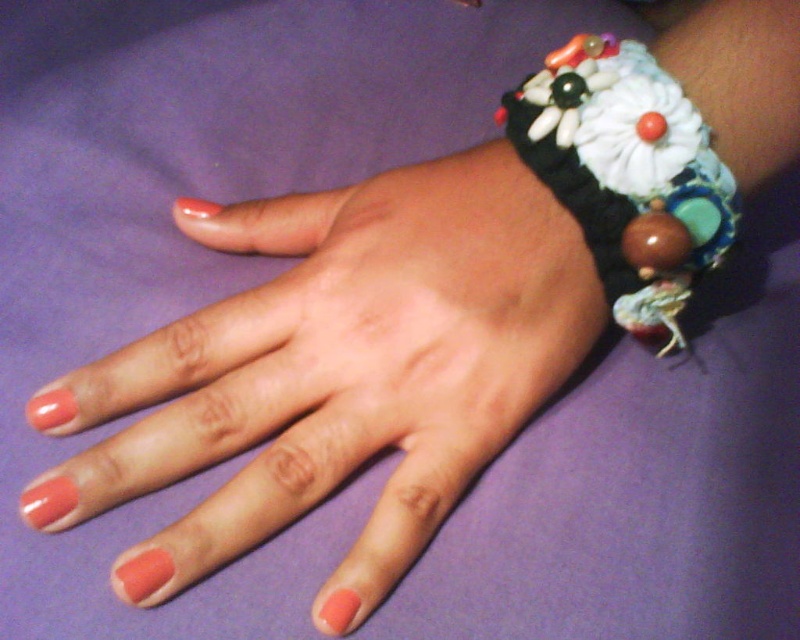
Can you confirm if matte black bracelet at upper right is taller than textured fabric bracelet at upper right?

Correct, matte black bracelet at upper right is much taller as textured fabric bracelet at upper right.

Does matte black bracelet at upper right appear on the left side of textured fabric bracelet at upper right?

Indeed, matte black bracelet at upper right is positioned on the left side of textured fabric bracelet at upper right.

Who is more distant from viewer, (582,259) or (620,141)?

The point (582,259) is more distant.

In order to click on matte black bracelet at upper right in this screenshot , I will do `click(336, 371)`.